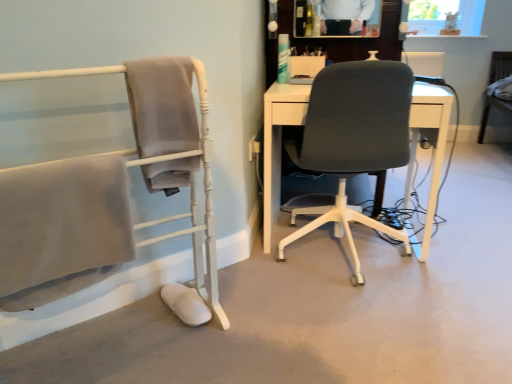
You are a GUI agent. You are given a task and a screenshot of the screen. Output one action in this format:
    pyautogui.click(x=<x>, y=<y>)
    Task: Click on the vacant area in front of dark gray fabric office chair at center, which is the second chair in back-to-front order
    The width and height of the screenshot is (512, 384).
    Given the screenshot: What is the action you would take?
    pyautogui.click(x=365, y=326)